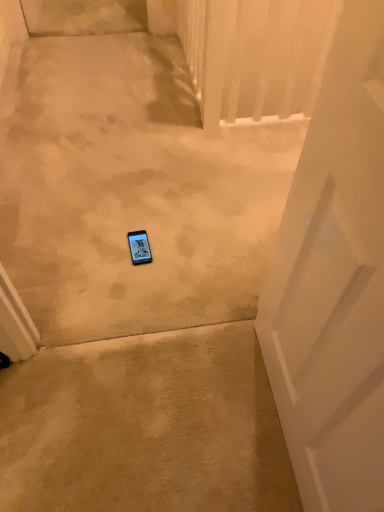
Question: From the image's perspective, is white matte door at center above or below matte black phone at center?

Choices:
 (A) above
 (B) below

Answer: (B)

Question: Considering the positions of white matte door at center and matte black phone at center in the image, is white matte door at center taller or shorter than matte black phone at center?

Choices:
 (A) tall
 (B) short

Answer: (A)

Question: In terms of size, does white matte door at center appear bigger or smaller than matte black phone at center?

Choices:
 (A) small
 (B) big

Answer: (B)

Question: Is matte black phone at center taller or shorter than white matte door at center?

Choices:
 (A) tall
 (B) short

Answer: (B)

Question: Considering the positions of matte black phone at center and white matte door at center in the image, is matte black phone at center wider or thinner than white matte door at center?

Choices:
 (A) wide
 (B) thin

Answer: (A)

Question: From the image's perspective, is matte black phone at center above or below white matte door at center?

Choices:
 (A) below
 (B) above

Answer: (B)

Question: Is point (137, 254) positioned closer to the camera than point (339, 228)?

Choices:
 (A) farther
 (B) closer

Answer: (A)